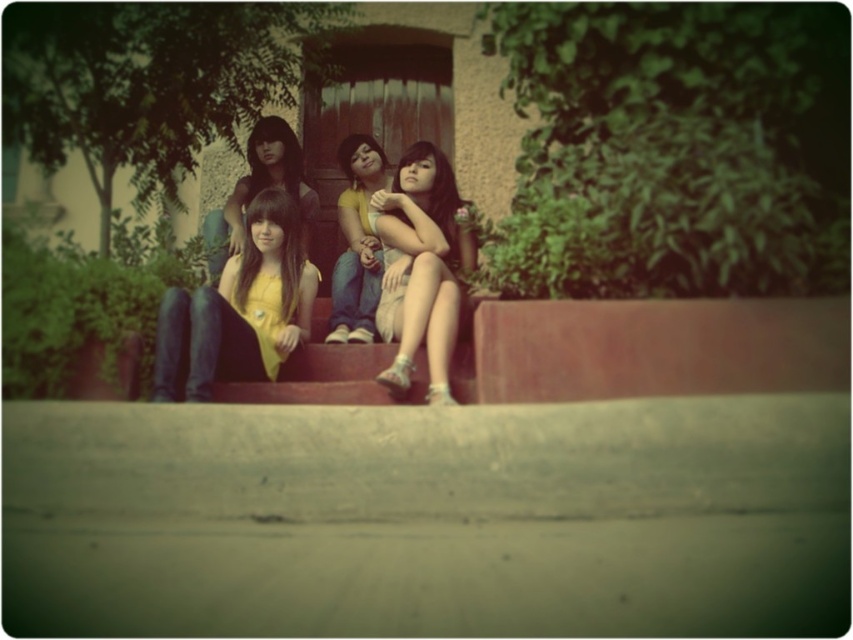
You are organizing a clothing sale and need to display the matte gray dress at center and the matte yellow shirt at center on a rack. If the rack has limited space, which item should you prioritize placing first based on their sizes?

The matte gray dress at center has a larger size compared to the matte yellow shirt at center, so you should prioritize placing the matte gray dress at center first to ensure it fits on the rack.